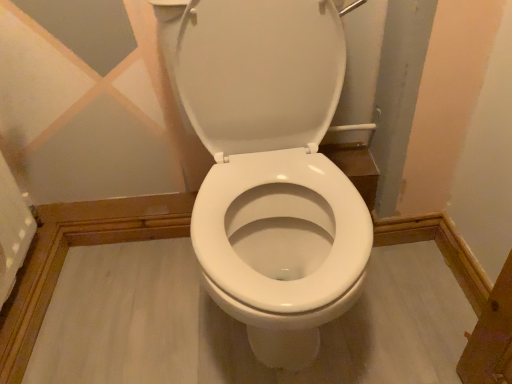
At what (x,y) coordinates should I click in order to perform the action: click on white glossy toilet at center. Please return your answer as a coordinate pair (x, y). Looking at the image, I should click on (269, 166).

What is the approximate height of white glossy toilet at center?

white glossy toilet at center is 33.10 inches tall.

The width and height of the screenshot is (512, 384). Describe the element at coordinates (269, 166) in the screenshot. I see `white glossy toilet at center` at that location.

Locate an element on the screen. white glossy toilet at center is located at coordinates (269, 166).